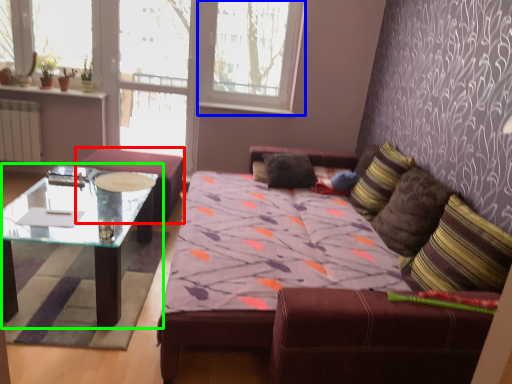
Question: Which object is positioned closest to chair (highlighted by a red box)? Select from window frame (highlighted by a blue box) and coffee table (highlighted by a green box).

Choices:
 (A) window frame
 (B) coffee table

Answer: (B)